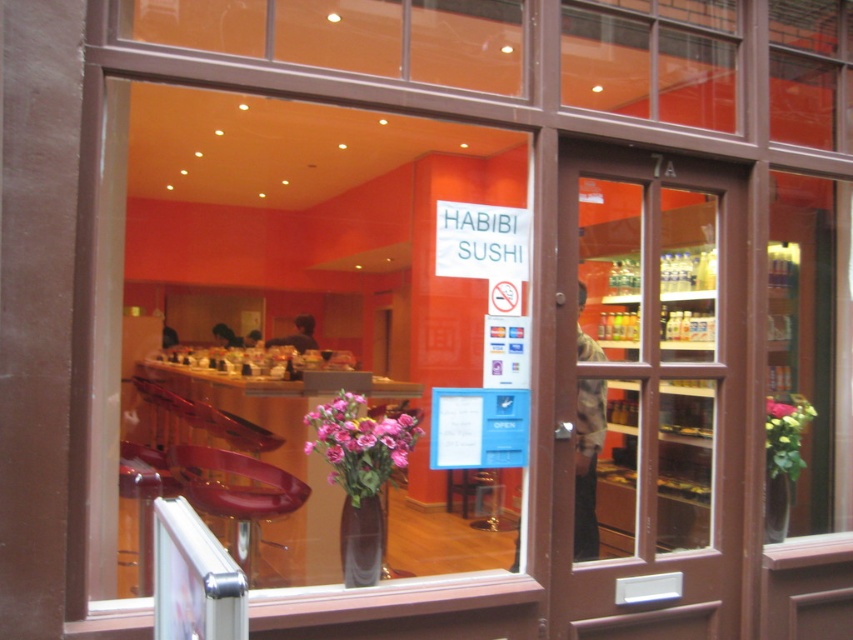
You are standing outside the Habibi Sushi restaurant and want to enter. You see the brown wooden door at center and the pink matte vase at center. Which object is closer to your right side when facing the entrance?

The brown wooden door at center is to the right of the pink matte vase at center, so when facing the entrance, the brown wooden door at center is closer to your right side.

You are a customer arriving at the Habibi Sushi restaurant. You see the brown wooden door at center and the pink matte vase at center. Which object is closer to you as you approach the entrance?

The brown wooden door at center is closer to you because the pink matte vase at center is positioned behind it.

You are a delivery person standing at the entrance of the sushi restaurant. You need to place a bouquet of flowers in a vase that is closest to the entrance. Which vase should you choose between the translucent glass vase at center and the pink matte vase at lower right?

The pink matte vase at lower right is closer to the entrance than the translucent glass vase at center, so you should choose the pink matte vase at lower right.